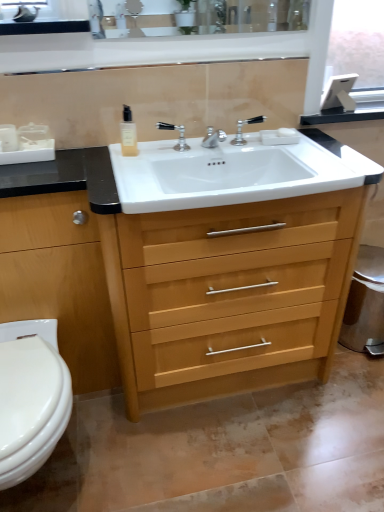
Question: Does white plastic container at left contain white glossy sink at center?

Choices:
 (A) yes
 (B) no

Answer: (B)

Question: Are white plastic container at left and white glossy sink at center far apart?

Choices:
 (A) no
 (B) yes

Answer: (A)

Question: From the image's perspective, is white plastic container at left beneath white glossy sink at center?

Choices:
 (A) yes
 (B) no

Answer: (B)

Question: Does white plastic container at left have a smaller size compared to white glossy sink at center?

Choices:
 (A) yes
 (B) no

Answer: (A)

Question: Considering the relative positions of white plastic container at left and white glossy sink at center in the image provided, is white plastic container at left to the left of white glossy sink at center from the viewer's perspective?

Choices:
 (A) no
 (B) yes

Answer: (B)

Question: Is point (28, 210) closer or farther from the camera than point (11, 129)?

Choices:
 (A) farther
 (B) closer

Answer: (B)

Question: Relative to white plastic container at left, is light wood/finish chest of drawers at left in front or behind?

Choices:
 (A) front
 (B) behind

Answer: (A)

Question: Looking at the image, does light wood/finish chest of drawers at left seem bigger or smaller compared to white plastic container at left?

Choices:
 (A) big
 (B) small

Answer: (A)

Question: Is light wood/finish chest of drawers at left wider or thinner than white plastic container at left?

Choices:
 (A) thin
 (B) wide

Answer: (B)

Question: Is white plastic container at left wider or thinner than polished chrome faucet at center, placed as the second tap when sorted from left to right?

Choices:
 (A) thin
 (B) wide

Answer: (B)

Question: Based on their sizes in the image, would you say white plastic container at left is bigger or smaller than polished chrome faucet at center, the first tap positioned from the right?

Choices:
 (A) small
 (B) big

Answer: (A)

Question: Relative to polished chrome faucet at center, placed as the second tap when sorted from left to right, is white plastic container at left in front or behind?

Choices:
 (A) behind
 (B) front

Answer: (B)

Question: Is white plastic container at left taller or shorter than polished chrome faucet at center, the first tap positioned from the right?

Choices:
 (A) short
 (B) tall

Answer: (A)

Question: Is white matte soap at upper center to the left or to the right of polished chrome faucet at center, the second tap positioned from the right, in the image?

Choices:
 (A) left
 (B) right

Answer: (B)

Question: Considering their positions, is white matte soap at upper center located in front of or behind polished chrome faucet at center, the first tap in the left-to-right sequence?

Choices:
 (A) front
 (B) behind

Answer: (B)